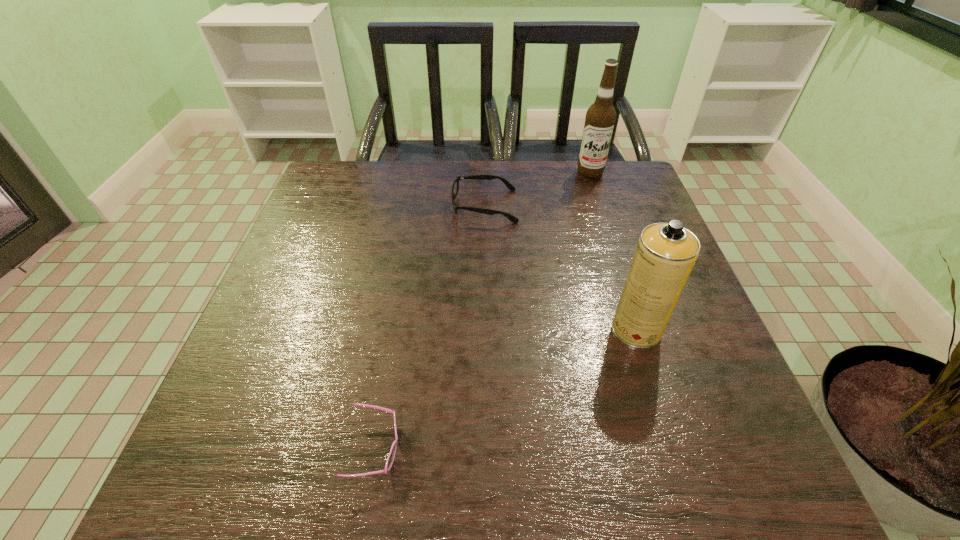
Where is `vacant region located 0.060m on the front-facing side of the second farthest object`? The width and height of the screenshot is (960, 540). vacant region located 0.060m on the front-facing side of the second farthest object is located at coordinates (430, 206).

Where is `vacant space located 0.100m on the front-facing side of the second farthest object`? The height and width of the screenshot is (540, 960). vacant space located 0.100m on the front-facing side of the second farthest object is located at coordinates (416, 206).

The image size is (960, 540). Find the location of `vacant space located 0.210m on the front-facing side of the nearest object`. vacant space located 0.210m on the front-facing side of the nearest object is located at coordinates (528, 449).

Where is `alcohol at the far edge`? Image resolution: width=960 pixels, height=540 pixels. alcohol at the far edge is located at coordinates (600, 118).

The image size is (960, 540). I want to click on spectacles at the far edge, so click(x=455, y=187).

The image size is (960, 540). Find the location of `object located at the near edge`. object located at the near edge is located at coordinates pos(391,456).

The image size is (960, 540). Find the location of `alcohol present at the right edge`. alcohol present at the right edge is located at coordinates coord(600,118).

This screenshot has height=540, width=960. What are the coordinates of `aerosol can present at the right edge` in the screenshot? It's located at (665, 254).

You are a GUI agent. You are given a task and a screenshot of the screen. Output one action in this format:
    pyautogui.click(x=<x>, y=<y>)
    Task: Click on the object that is at the far right corner
    This screenshot has height=540, width=960.
    Given the screenshot: What is the action you would take?
    pyautogui.click(x=600, y=118)

In the image, there is a desktop. Identify the location of vacant space at the far edge. The image size is (960, 540). (511, 171).